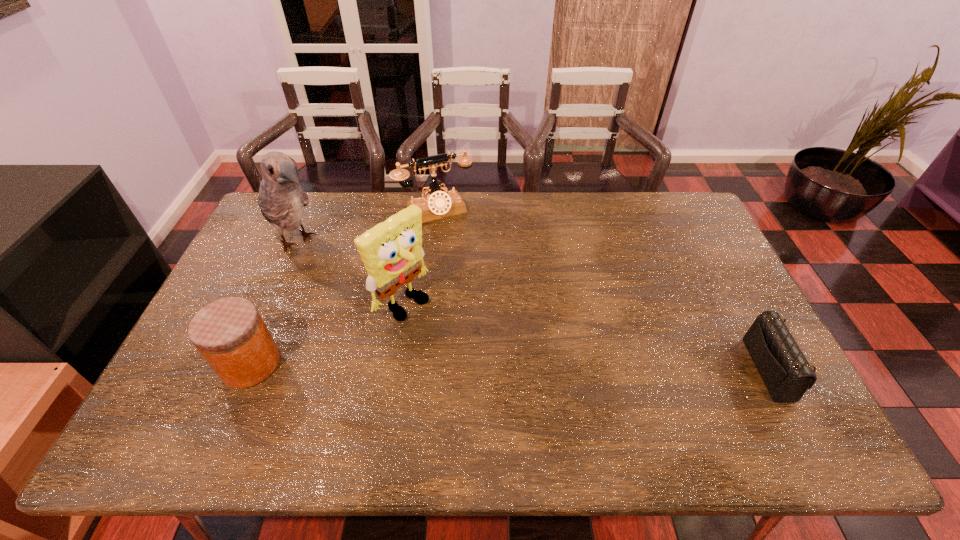
In the image, there is a desktop. Where is `free region at the near left corner`? Image resolution: width=960 pixels, height=540 pixels. free region at the near left corner is located at coordinates (213, 401).

Locate an element on the screen. vacant region at the far right corner of the desktop is located at coordinates (661, 203).

The width and height of the screenshot is (960, 540). Identify the location of free space at the near right corner of the desktop. (750, 389).

The height and width of the screenshot is (540, 960). What are the coordinates of `vacant region between the sponge and the rightmost object` in the screenshot? It's located at (588, 336).

Identify the location of blank region between the clutch bag and the telephone. This screenshot has width=960, height=540. (604, 290).

Locate an element on the screen. This screenshot has width=960, height=540. free space between the clutch bag and the third tallest object is located at coordinates (604, 290).

At what (x,y) coordinates should I click in order to perform the action: click on free spot between the rightmost object and the parrot. Please return your answer as a coordinate pair (x, y). This screenshot has height=540, width=960. Looking at the image, I should click on (536, 306).

Find the location of a particular element. This screenshot has height=540, width=960. unoccupied area between the parrot and the jar is located at coordinates (275, 302).

Identify the location of free space between the sponge and the parrot. (350, 272).

You are a GUI agent. You are given a task and a screenshot of the screen. Output one action in this format:
    pyautogui.click(x=<x>, y=<y>)
    Task: Click on the blank region between the clutch bag and the third tallest object
    
    Given the screenshot: What is the action you would take?
    pyautogui.click(x=604, y=290)